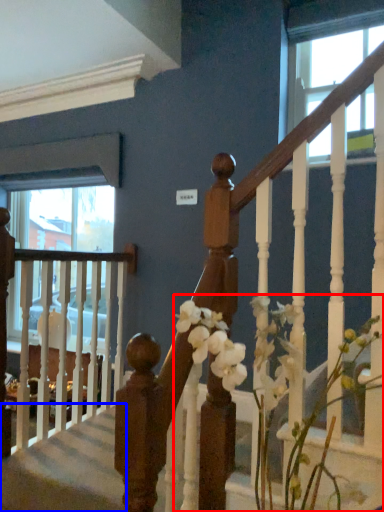
Question: Which object appears farthest to the camera in this image, floral arrangement (highlighted by a red box) or stairwell (highlighted by a blue box)?

Choices:
 (A) floral arrangement
 (B) stairwell

Answer: (B)